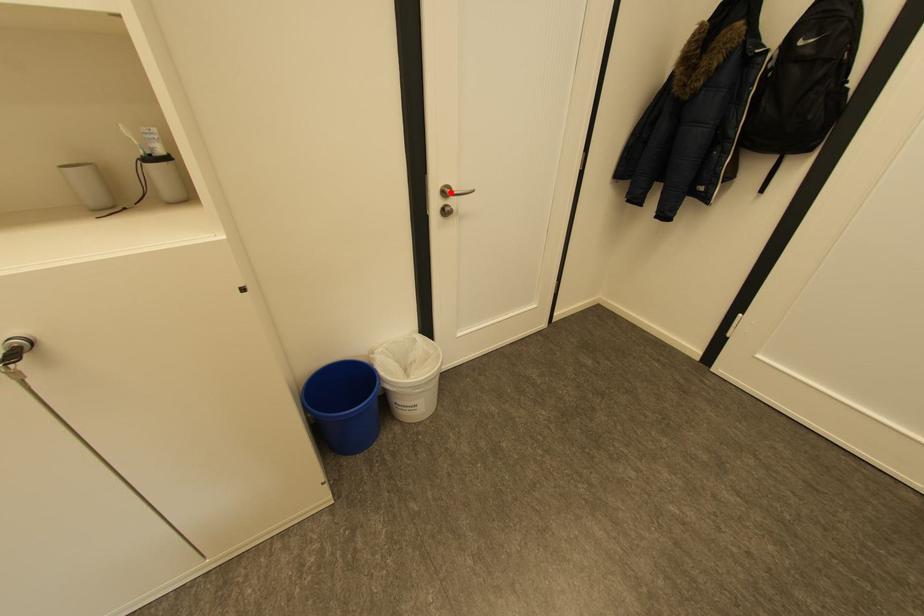
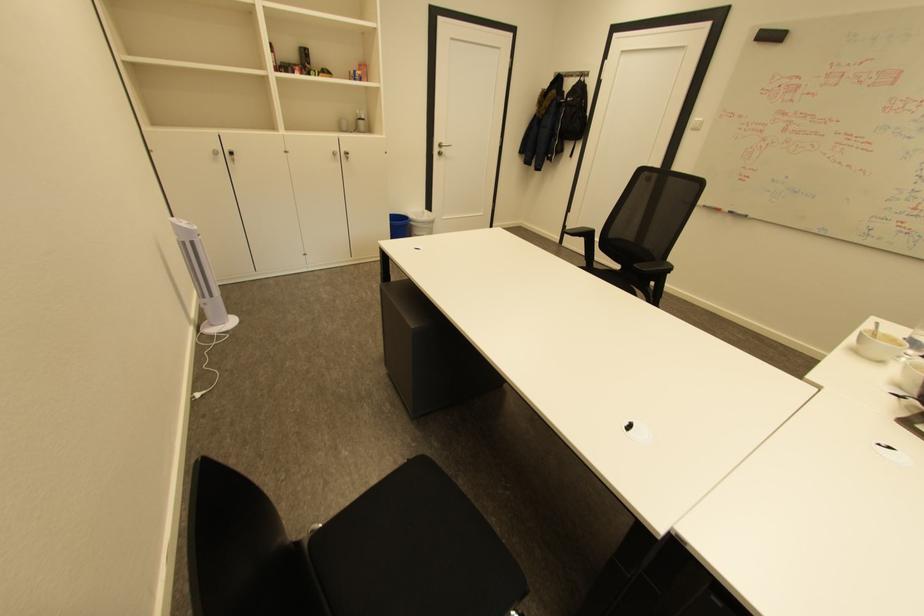
Question: I am providing you with two images of the same scene from different viewpoints. Given a red point in image1, look at the same physical point in image2. Is it:

Choices:
 (A) Closer to the viewpoint
 (B) Farther from the viewpoint

Answer: (A)